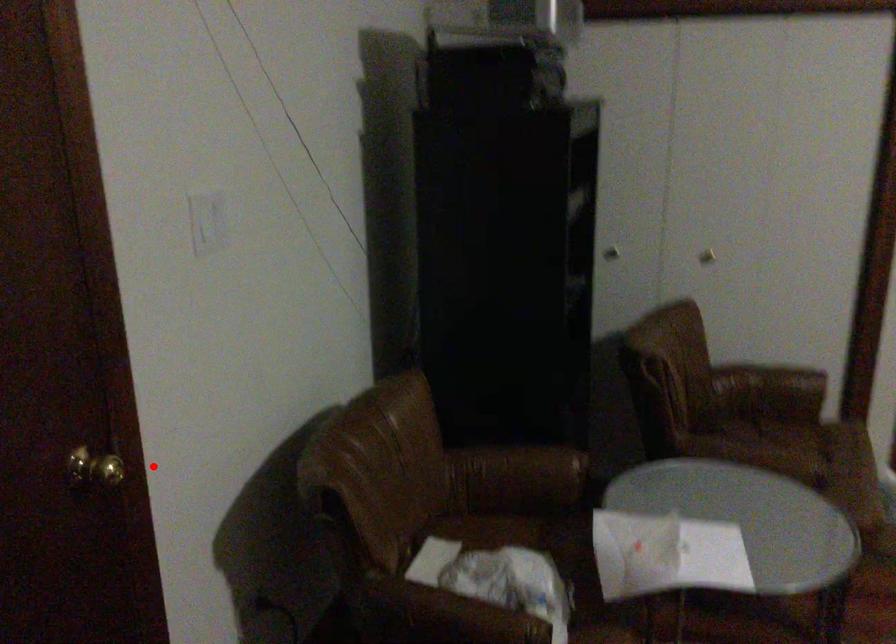
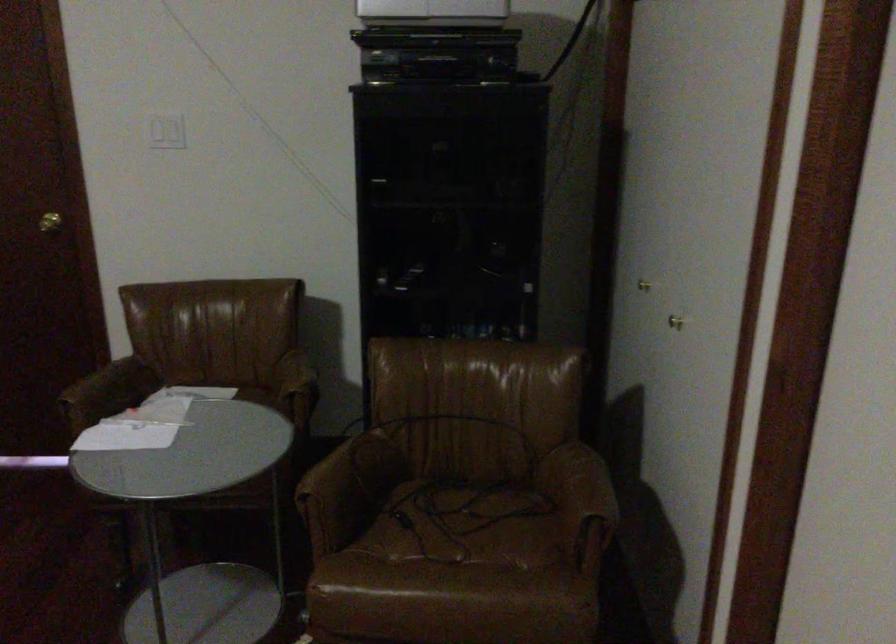
Find the pixel in the second image that matches the highlighted location in the first image.

(49, 222)